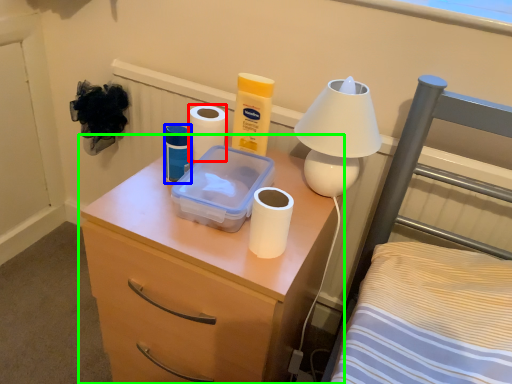
Question: Considering the real-world distances, which object is farthest from toilet paper (highlighted by a red box)? toiletry (highlighted by a blue box) or nightstand (highlighted by a green box)?

Choices:
 (A) toiletry
 (B) nightstand

Answer: (B)